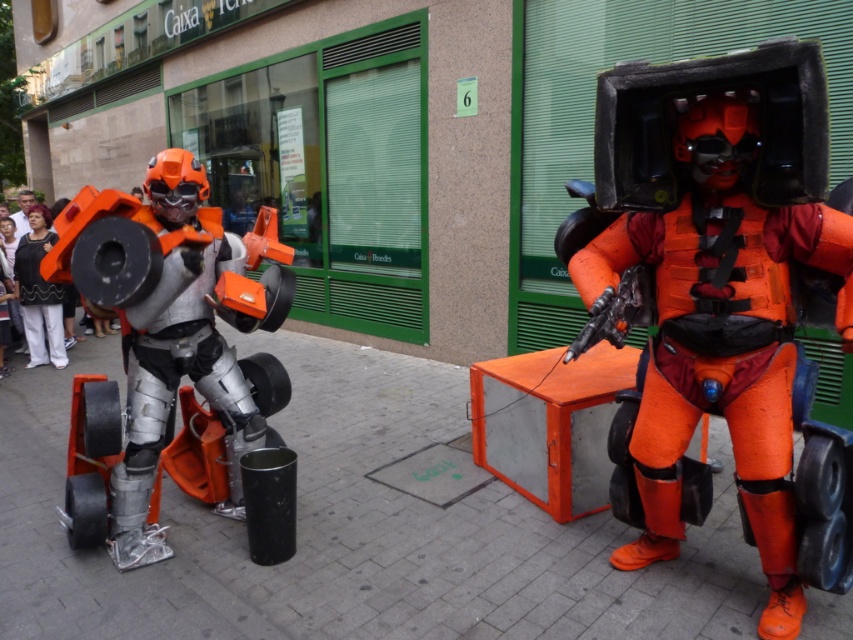
Between matte orange robot at center and matte black pants at center, which one has less height?

With less height is matte black pants at center.

At what (x,y) coordinates should I click in order to perform the action: click on matte orange robot at center. Please return your answer as a coordinate pair (x, y). Looking at the image, I should click on (177, 349).

Is orange matte robot at right thinner than matte black pants at center?

No, orange matte robot at right is not thinner than matte black pants at center.

Does orange matte robot at right have a smaller size compared to matte black pants at center?

Indeed, orange matte robot at right has a smaller size compared to matte black pants at center.

Who is more forward, (781, 292) or (33, 358)?

Point (781, 292)

The height and width of the screenshot is (640, 853). I want to click on orange matte robot at right, so click(x=720, y=332).

Who is shorter, orange matte robot at right or matte orange robot at center?

Standing shorter between the two is matte orange robot at center.

Is point (676, 289) behind point (206, 440)?

No, it is in front of (206, 440).

Where is `orange matte robot at right`? orange matte robot at right is located at coordinates (720, 332).